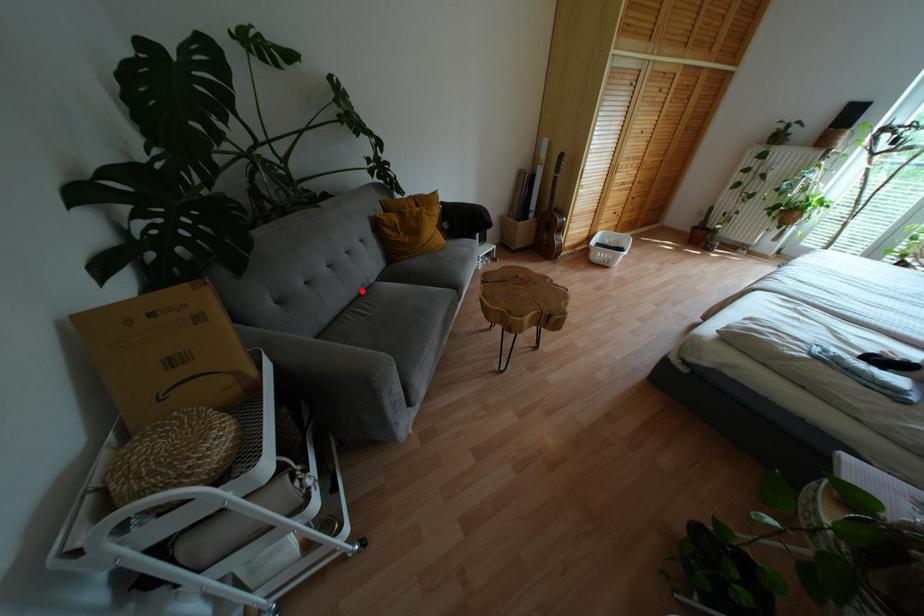
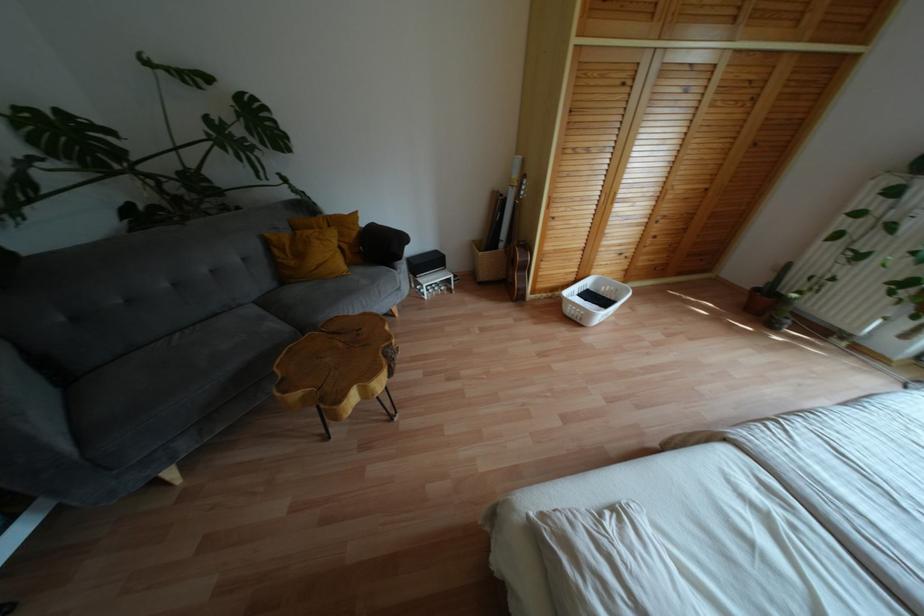
Question: I am providing you with two images of the same scene from different viewpoints. A red point is marked on the first image. Is the red point's position out of view in image 2?

Choices:
 (A) Yes
 (B) No

Answer: (B)